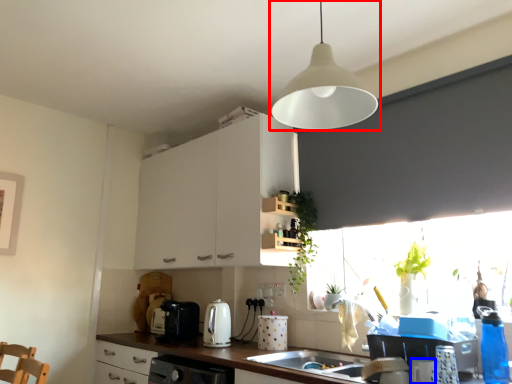
Question: Which of the following is the closest to the observer, lamp (highlighted by a red box) or appliance (highlighted by a blue box)?

Choices:
 (A) lamp
 (B) appliance

Answer: (A)